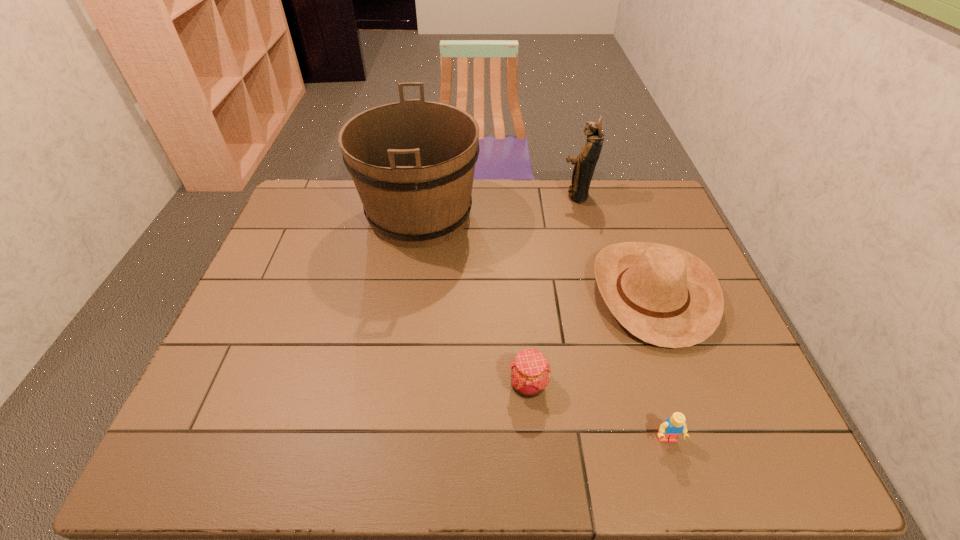
Locate an element on the screen. vacant position located 0.280m on the front-facing side of the figurine is located at coordinates (479, 195).

Find the location of `vacant space located on the front-facing side of the cowboy hat`. vacant space located on the front-facing side of the cowboy hat is located at coordinates (467, 293).

You are a GUI agent. You are given a task and a screenshot of the screen. Output one action in this format:
    pyautogui.click(x=<x>, y=<y>)
    Task: Click on the vacant space located 0.170m on the front-facing side of the cowboy hat
    Image resolution: width=960 pixels, height=540 pixels.
    Given the screenshot: What is the action you would take?
    pyautogui.click(x=531, y=293)

This screenshot has width=960, height=540. Identify the location of vacant space situated on the front-facing side of the cowboy hat. (520, 293).

Locate an element on the screen. free space located on the back of the fourth object from right to left is located at coordinates (524, 344).

You are a GUI agent. You are given a task and a screenshot of the screen. Output one action in this format:
    pyautogui.click(x=<x>, y=<y>)
    Task: Click on the bucket located at the far edge
    The image size is (960, 540).
    Given the screenshot: What is the action you would take?
    pyautogui.click(x=412, y=162)

The height and width of the screenshot is (540, 960). Identify the location of figurine that is at the far edge. (585, 163).

Image resolution: width=960 pixels, height=540 pixels. I want to click on object situated at the near edge, so click(671, 428).

This screenshot has height=540, width=960. Identify the location of object that is at the right edge. (663, 295).

I want to click on free space at the far edge of the desktop, so click(x=486, y=198).